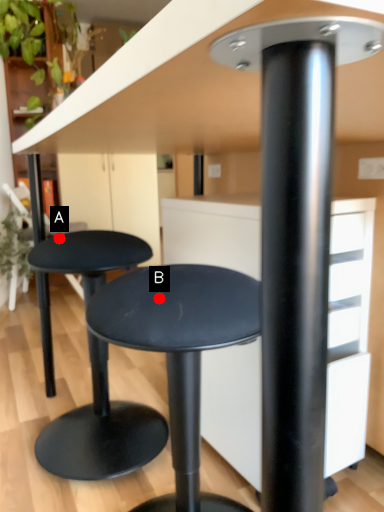
Question: Two points are circled on the image, labeled by A and B beside each circle. Which point appears closest to the camera in this image?

Choices:
 (A) A is closer
 (B) B is closer

Answer: (B)